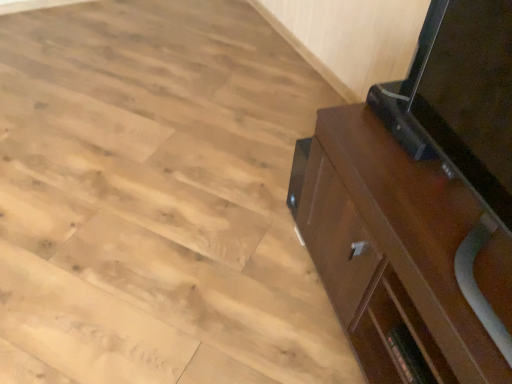
Question: Should I look upward or downward to see dark brown wood cabinet at right?

Choices:
 (A) down
 (B) up

Answer: (A)

Question: Is natural wood floor at lower right located outside dark brown wood cabinet at right?

Choices:
 (A) no
 (B) yes

Answer: (B)

Question: Is natural wood floor at lower right to the left of dark brown wood cabinet at right from the viewer's perspective?

Choices:
 (A) yes
 (B) no

Answer: (A)

Question: Is natural wood floor at lower right bigger than dark brown wood cabinet at right?

Choices:
 (A) yes
 (B) no

Answer: (A)

Question: Is the depth of natural wood floor at lower right greater than that of dark brown wood cabinet at right?

Choices:
 (A) no
 (B) yes

Answer: (B)

Question: From the image's perspective, would you say natural wood floor at lower right is shown under dark brown wood cabinet at right?

Choices:
 (A) no
 (B) yes

Answer: (A)

Question: Is natural wood floor at lower right positioned far away from dark brown wood cabinet at right?

Choices:
 (A) no
 (B) yes

Answer: (A)

Question: From a real-world perspective, is dark brown wood cabinet at right located beneath natural wood floor at lower right?

Choices:
 (A) no
 (B) yes

Answer: (A)

Question: Does dark brown wood cabinet at right appear on the right side of natural wood floor at lower right?

Choices:
 (A) no
 (B) yes

Answer: (B)

Question: Would you say dark brown wood cabinet at right is a long distance from natural wood floor at lower right?

Choices:
 (A) yes
 (B) no

Answer: (B)

Question: From the image's perspective, is dark brown wood cabinet at right on top of natural wood floor at lower right?

Choices:
 (A) yes
 (B) no

Answer: (B)

Question: Is dark brown wood cabinet at right bigger than natural wood floor at lower right?

Choices:
 (A) no
 (B) yes

Answer: (A)

Question: Is dark brown wood cabinet at right closer to camera compared to natural wood floor at lower right?

Choices:
 (A) no
 (B) yes

Answer: (B)

Question: From a real-world perspective, is dark brown wood cabinet at right positioned above or below natural wood floor at lower right?

Choices:
 (A) below
 (B) above

Answer: (B)